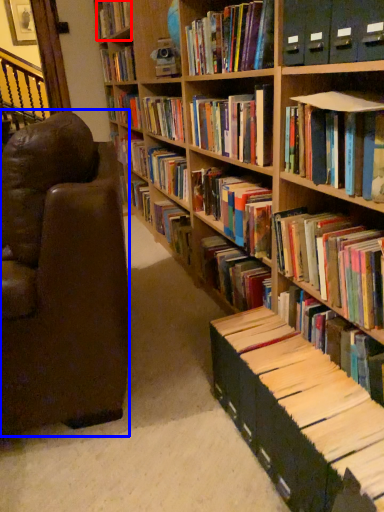
Question: Which object appears farthest to the camera in this image, book (highlighted by a red box) or chair (highlighted by a blue box)?

Choices:
 (A) book
 (B) chair

Answer: (A)